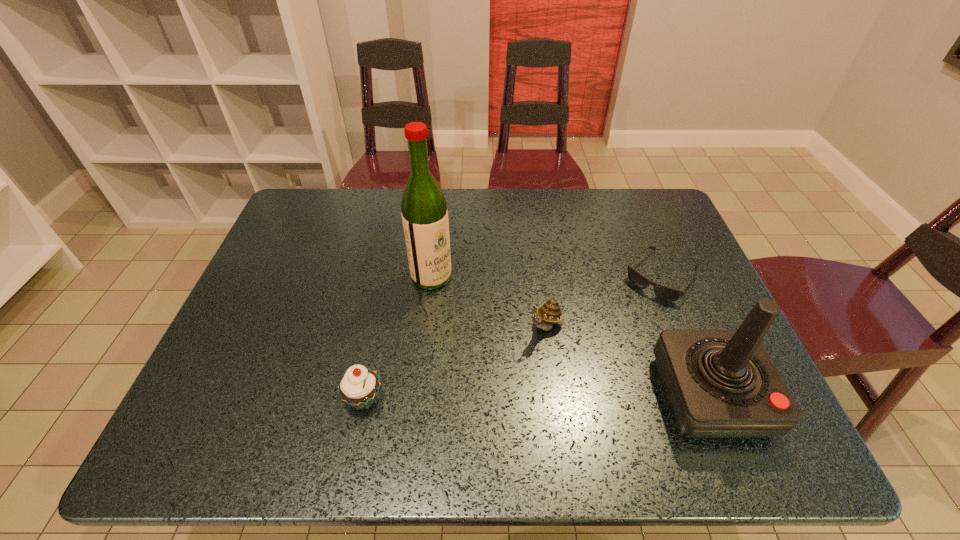
I want to click on free space on the desktop that is between the leftmost object and the second tallest object and is positioned on the face of the third object from left to right, so click(x=492, y=398).

You are a GUI agent. You are given a task and a screenshot of the screen. Output one action in this format:
    pyautogui.click(x=<x>, y=<y>)
    Task: Click on the vacant space on the desktop that is between the cupcake and the joystick and is positioned on the front-facing side of the shortest object
    
    Given the screenshot: What is the action you would take?
    pyautogui.click(x=570, y=397)

Locate an element on the screen. This screenshot has width=960, height=540. free space on the desktop that is between the leftmost object and the joystick and is positioned on the label of the tallest object is located at coordinates (588, 397).